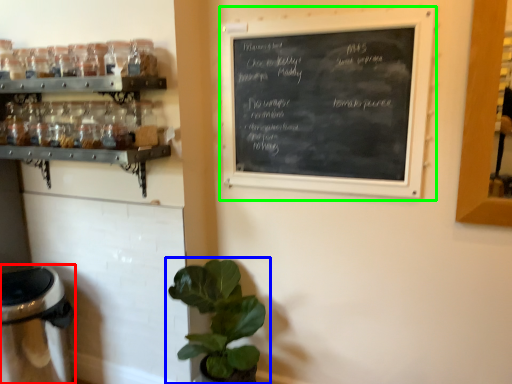
Question: Which is nearer to the appliance (highlighted by a red box)? houseplant (highlighted by a blue box) or bulletin board (highlighted by a green box).

Choices:
 (A) houseplant
 (B) bulletin board

Answer: (A)